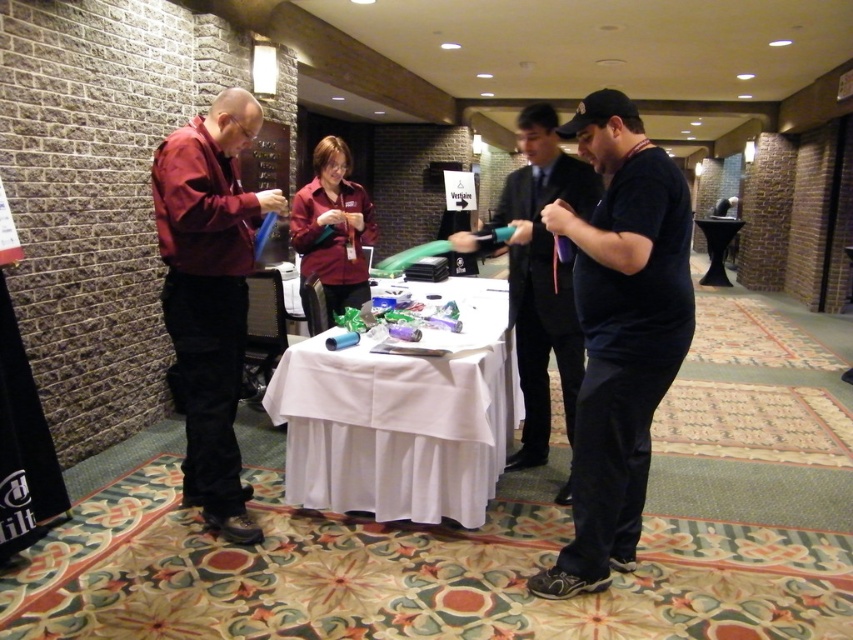
Who is positioned more to the right, white cloth-covered table at center or matte maroon shirt at center?

Positioned to the right is white cloth-covered table at center.

Is point (355, 433) closer to camera compared to point (302, 244)?

That is True.

Image resolution: width=853 pixels, height=640 pixels. Identify the location of white cloth-covered table at center. (402, 417).

Can you confirm if black matte shirt at right is positioned to the right of matte maroon shirt at center?

Correct, you'll find black matte shirt at right to the right of matte maroon shirt at center.

Between point (561, 282) and point (335, 276), which one is positioned behind?

The point (335, 276) is behind.

At what (x,y) coordinates should I click in order to perform the action: click on black matte shirt at right. Please return your answer as a coordinate pair (x, y). Image resolution: width=853 pixels, height=640 pixels. Looking at the image, I should click on (538, 275).

At what (x,y) coordinates should I click in order to perform the action: click on black matte shirt at right. Please return your answer as a coordinate pair (x, y). Looking at the image, I should click on (538, 275).

Describe the element at coordinates (619, 332) in the screenshot. I see `black matte shirt at center` at that location.

Is the position of black matte shirt at center more distant than that of matte maroon shirt at left?

No, black matte shirt at center is closer to the viewer.

Is point (592, 417) behind point (199, 316)?

No, (592, 417) is in front of (199, 316).

Where is `black matte shirt at center`? The height and width of the screenshot is (640, 853). black matte shirt at center is located at coordinates (619, 332).